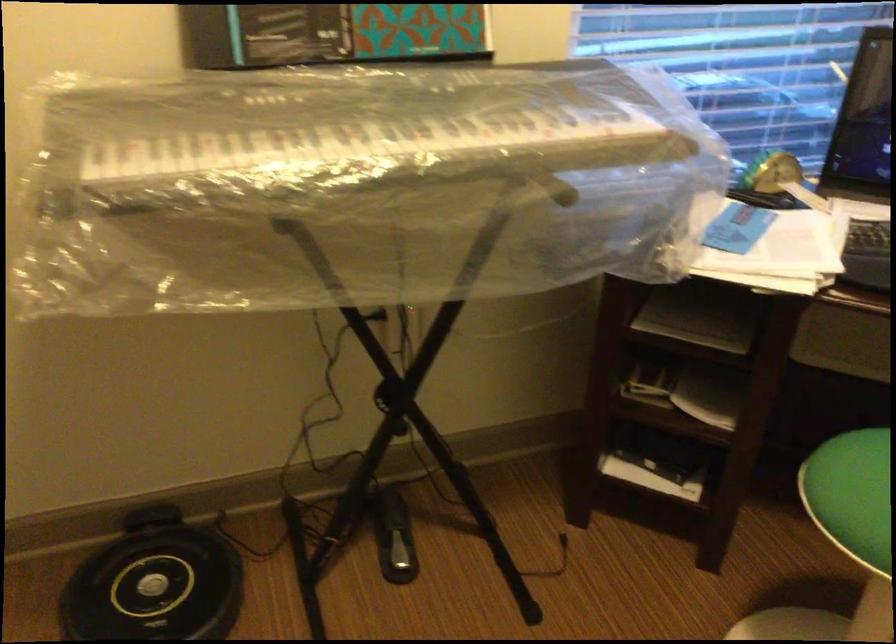
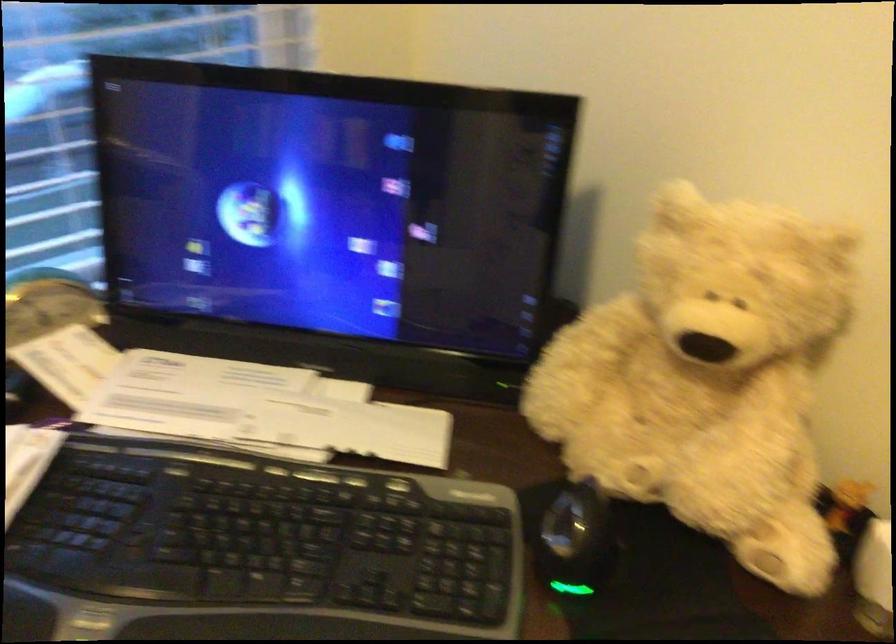
Which direction would the cameraman need to move to produce the second image?

The cameraman walked toward right, forward.